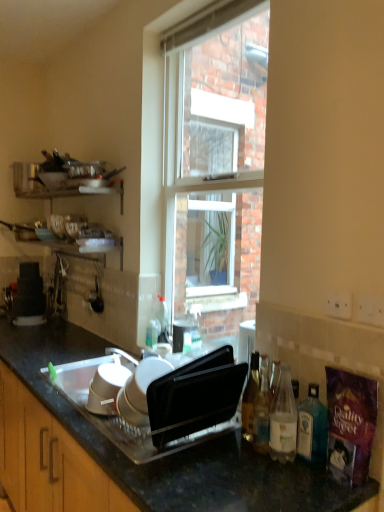
At what (x,y) coordinates should I click in order to perform the action: click on vacant position to the left of translucent glass bottle at lower right, acting as the third bottle starting from the left. Please return your answer as a coordinate pair (x, y). This screenshot has width=384, height=512. Looking at the image, I should click on (230, 461).